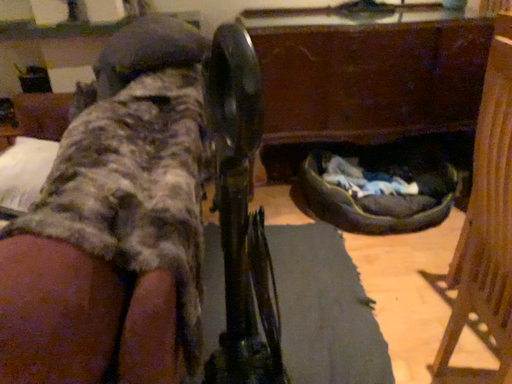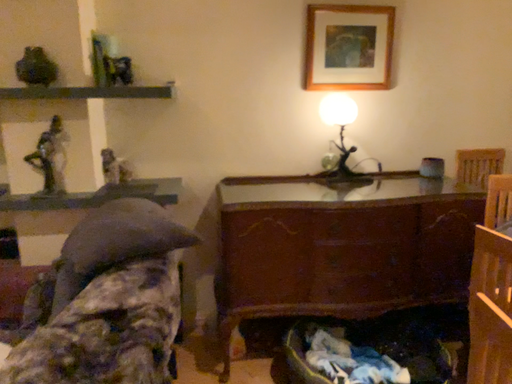
Question: Which way did the camera rotate in the video?

Choices:
 (A) rotated upward
 (B) rotated downward

Answer: (A)